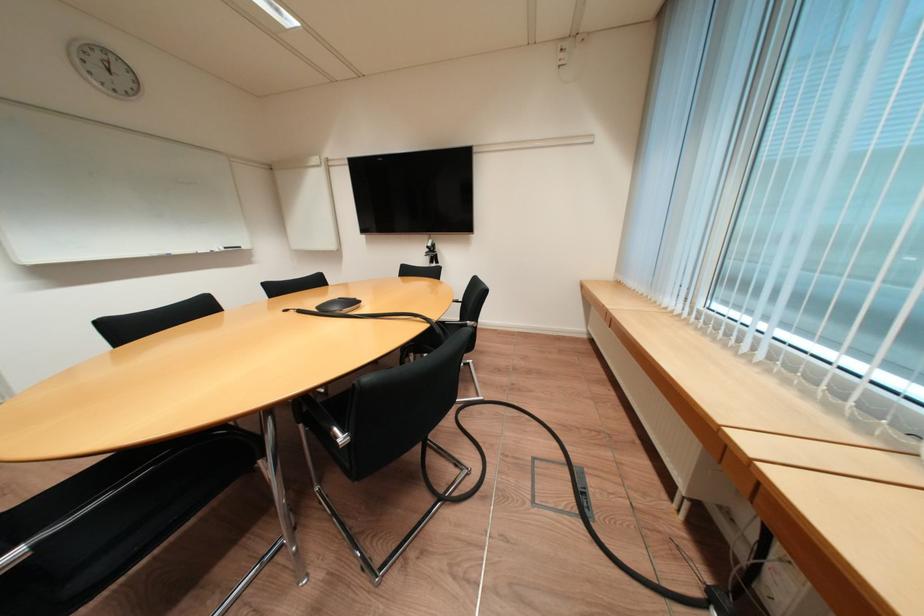
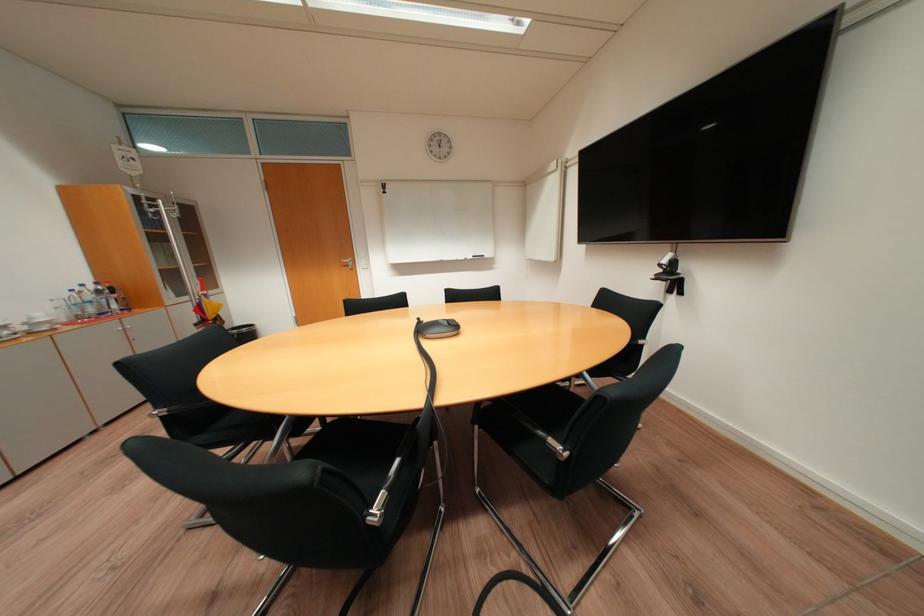
Locate, in the second image, the point that corresponds to pixel 439 246 in the first image.

(673, 262)